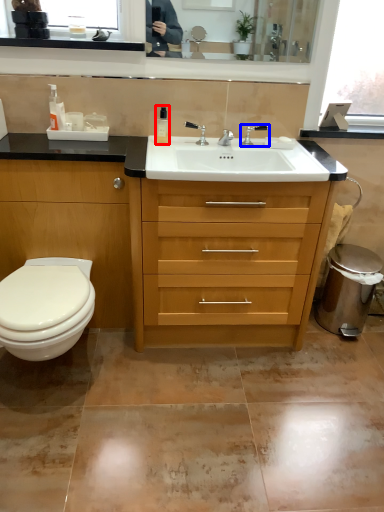
Question: Among these objects, which one is nearest to the camera, toiletry (highlighted by a red box) or tap (highlighted by a blue box)?

Choices:
 (A) toiletry
 (B) tap

Answer: (A)